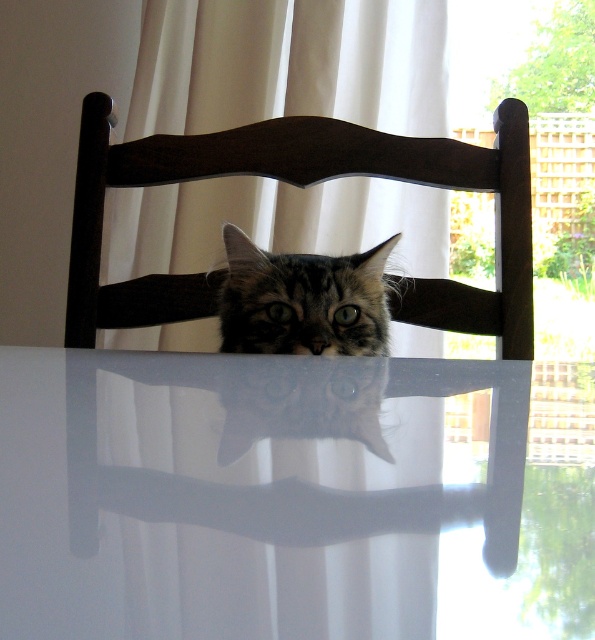
You are a pet sitter who needs to place a small feeding bowl for the tabby fur cat at center. The bowl requires a space of 30 cm in width. Given the white glossy table at center, can the cat fit on the table while the bowl is placed there?

The white glossy table at center is wider than the tabby fur cat at center, so there should be enough space for both the cat and the feeding bowl on the table.

You are trying to place a small plant pot on the white glossy table at center. The point you want to place it is at coordinates point (248,496). Is this point on the white glossy table at center?

Yes, the point (248,496) is on the white glossy table at center according to the provided coordinates.